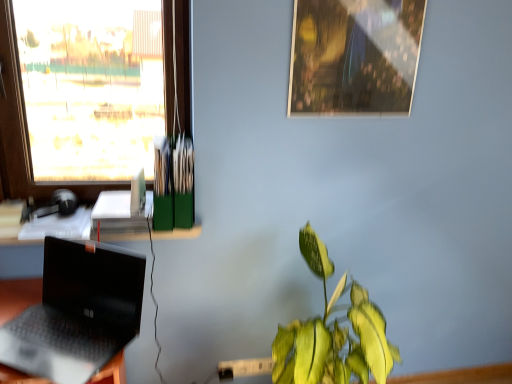
Question: In the image, is transparent glass window at upper left positioned in front of or behind green glossy leafy plant at lower right?

Choices:
 (A) behind
 (B) front

Answer: (A)

Question: Would you say transparent glass window at upper left is to the left or to the right of green glossy leafy plant at lower right in the picture?

Choices:
 (A) left
 (B) right

Answer: (A)

Question: Which of these objects is positioned farthest from the transparent glass window at upper left?

Choices:
 (A) green glossy leafy plant at lower right
 (B) metallic reflective photo frame at upper center
 (C) black matte laptop at lower left
 (D) white plastic power outlet at lower center

Answer: (D)

Question: Considering the real-world distances, which object is closest to the green glossy leafy plant at lower right?

Choices:
 (A) white plastic power outlet at lower center
 (B) metallic reflective photo frame at upper center
 (C) black matte laptop at lower left
 (D) transparent glass window at upper left

Answer: (A)